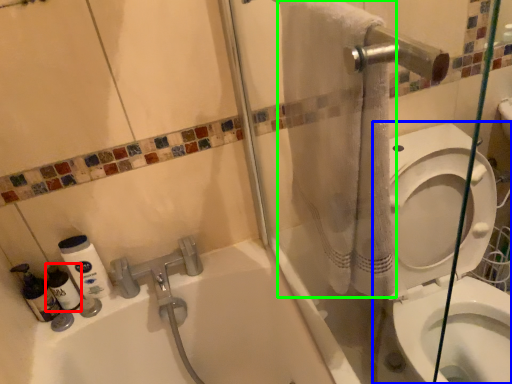
Question: Which object is the farthest from cleaning product (highlighted by a red box)? Choose among these: toilet (highlighted by a blue box) or bath towel (highlighted by a green box).

Choices:
 (A) toilet
 (B) bath towel

Answer: (A)